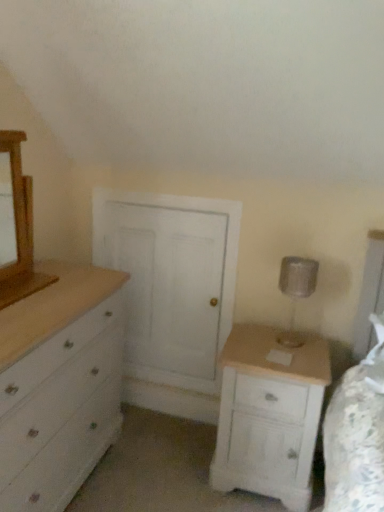
The width and height of the screenshot is (384, 512). In order to click on vacant space to the right of wooden medicine cabinet at left in this screenshot , I will do 62,286.